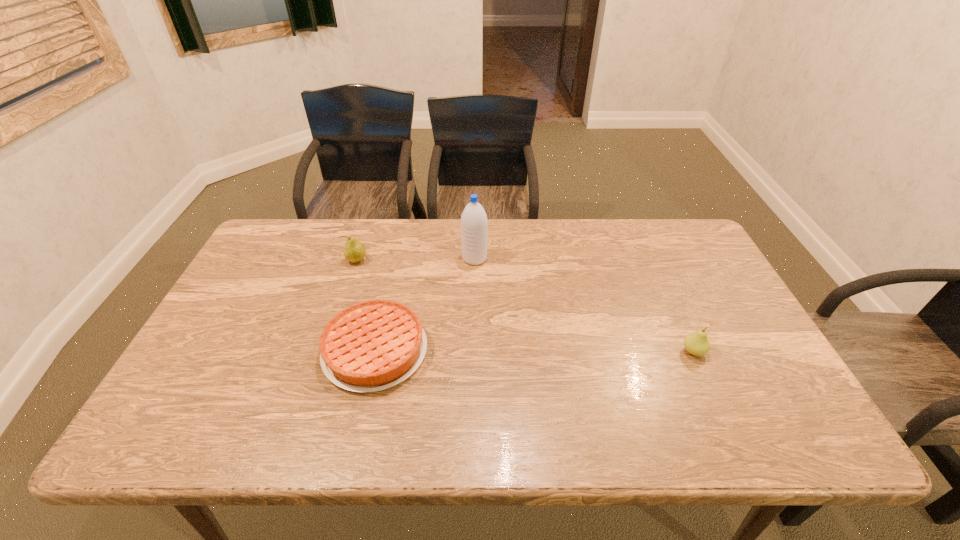
Locate an element on the screen. vacant space that is in between the water bottle and the farther pear is located at coordinates (416, 260).

Find the location of a particular element. The height and width of the screenshot is (540, 960). free space between the nearer pear and the left pear is located at coordinates (525, 306).

The height and width of the screenshot is (540, 960). I want to click on vacant area that lies between the shortest object and the water bottle, so click(424, 305).

At what (x,y) coordinates should I click in order to perform the action: click on free space between the nearer pear and the tallest object. Please return your answer as a coordinate pair (x, y). The width and height of the screenshot is (960, 540). Looking at the image, I should click on (584, 305).

You are a GUI agent. You are given a task and a screenshot of the screen. Output one action in this format:
    pyautogui.click(x=<x>, y=<y>)
    Task: Click on the free spot between the rightmost object and the farther pear
    This screenshot has height=540, width=960.
    Given the screenshot: What is the action you would take?
    pyautogui.click(x=525, y=306)

Identify the location of vacant space that's between the tallest object and the farther pear. (416, 260).

At what (x,y) coordinates should I click in order to perform the action: click on free spot between the right pear and the pie. Please return your answer as a coordinate pair (x, y). The image size is (960, 540). Looking at the image, I should click on (535, 351).

Identify the location of vacant area that lies between the tallest object and the pie. (424, 305).

This screenshot has height=540, width=960. Identify the location of object that is the closest to the right pear. (474, 224).

Locate an element on the screen. The width and height of the screenshot is (960, 540). the third closest object relative to the farther pear is located at coordinates 697,343.